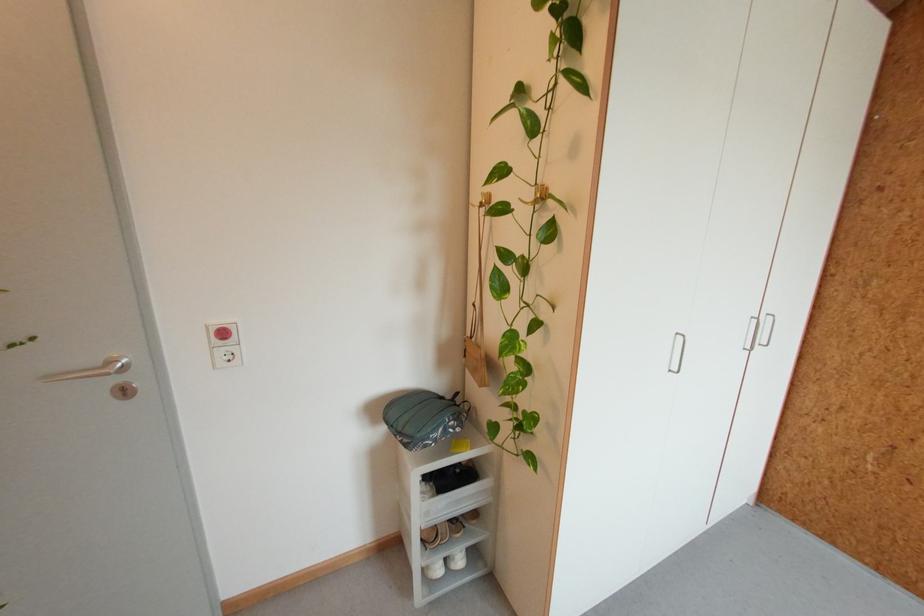
The image size is (924, 616). What do you see at coordinates (423, 418) in the screenshot?
I see `the black pouch` at bounding box center [423, 418].